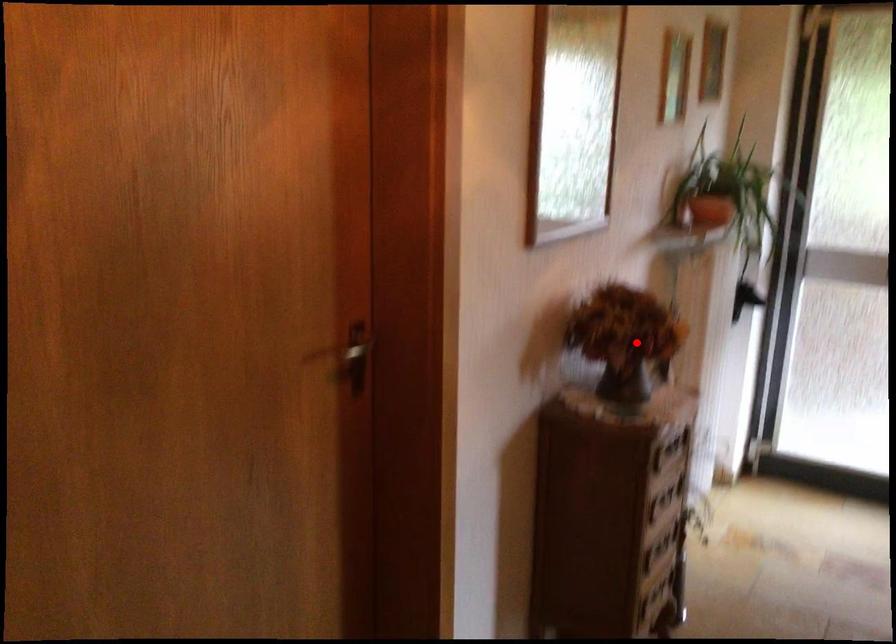
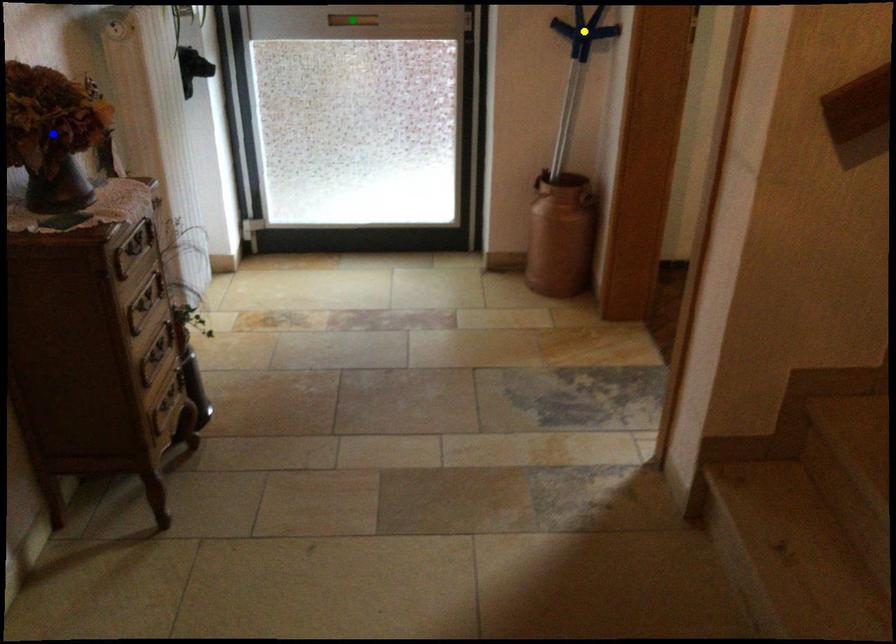
Question: I am providing you with two images of the same scene from different viewpoints. A red point is marked on the first image. You are given multiple points on the second image. Which mark in image 2 goes with the point in image 1?

Choices:
 (A) yellow point
 (B) green point
 (C) blue point

Answer: (C)